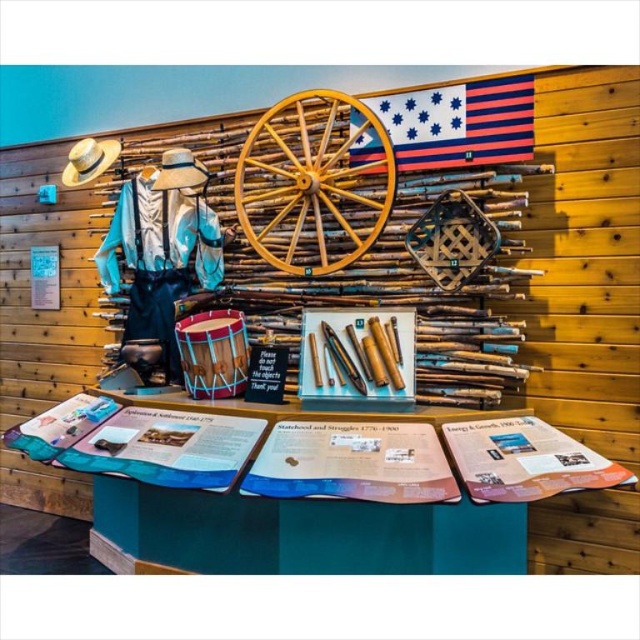
Question: Which point appears closest to the camera in this image?

Choices:
 (A) (512, 148)
 (B) (90, 177)
 (C) (220, 228)
 (D) (358, 118)

Answer: (A)

Question: Which point appears closest to the camera in this image?

Choices:
 (A) (257, 148)
 (B) (188, 157)
 (C) (401, 148)

Answer: (C)

Question: Does straw woven cowboy hat at upper left appear over light brown straw cowboy hat at upper left?

Choices:
 (A) yes
 (B) no

Answer: (A)

Question: Is straw woven cowboy hat at upper left wider than light brown straw cowboy hat at upper left?

Choices:
 (A) no
 (B) yes

Answer: (B)

Question: Among these objects, which one is nearest to the camera?

Choices:
 (A) light brown straw cowboy hat at upper left
 (B) striped fabric flag at upper center
 (C) blue denim jacket at left

Answer: (B)

Question: Where is wooden wagon wheel at center located in relation to light brown straw cowboy hat at upper left in the image?

Choices:
 (A) right
 (B) left

Answer: (A)